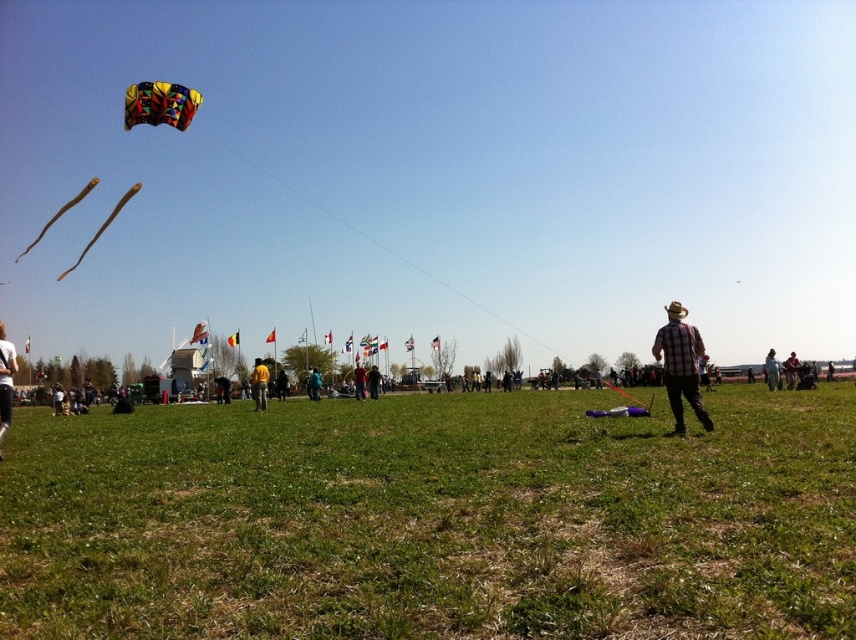
Question: Which of the following is the farthest from the observer?

Choices:
 (A) (147, 112)
 (B) (254, 356)
 (C) (316, 397)

Answer: (B)

Question: Which point appears closest to the camera in this image?

Choices:
 (A) (3, 410)
 (B) (693, 344)

Answer: (B)

Question: Is green grassy field at center above white cotton shirt at lower left?

Choices:
 (A) yes
 (B) no

Answer: (B)

Question: Is plaid fabric shirt at right below yellow plaid shirt at center?

Choices:
 (A) yes
 (B) no

Answer: (B)

Question: Where is yellow plaid shirt at center located in relation to blue denim jacket at center in the image?

Choices:
 (A) above
 (B) below

Answer: (A)

Question: Which object is farther from the camera taking this photo?

Choices:
 (A) light brown leather jacket at lower right
 (B) yellow plaid shirt at center

Answer: (A)